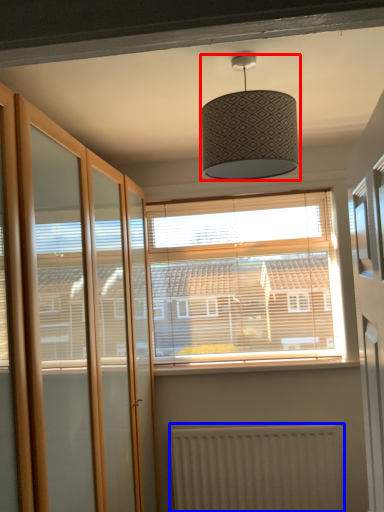
Question: Among these objects, which one is farthest to the camera, lamp (highlighted by a red box) or radiator (highlighted by a blue box)?

Choices:
 (A) lamp
 (B) radiator

Answer: (B)